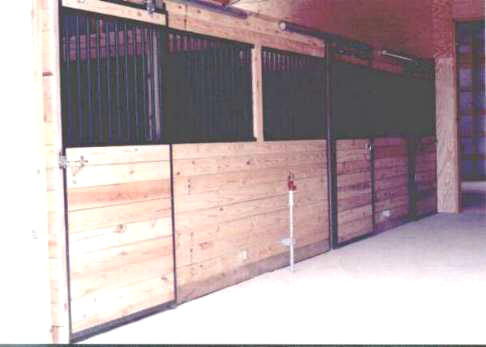
Where is `wall`? wall is located at coordinates (407, 27).